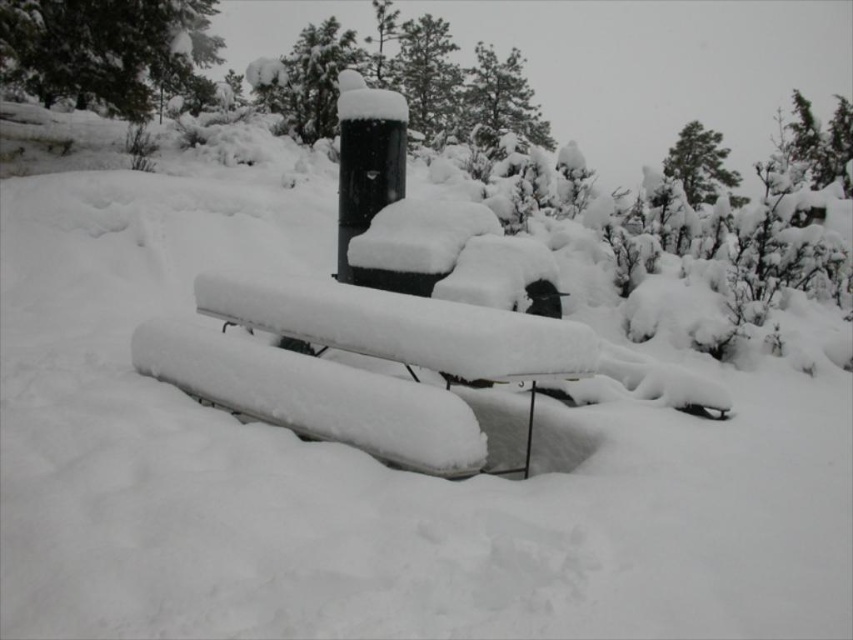
Which is below, green textured pine at upper left or green textured pine tree at upper center?

green textured pine at upper left is lower down.

What do you see at coordinates (103, 49) in the screenshot? Image resolution: width=853 pixels, height=640 pixels. I see `green textured pine at upper left` at bounding box center [103, 49].

The image size is (853, 640). Find the location of `green textured pine at upper left`. green textured pine at upper left is located at coordinates (103, 49).

Who is more forward, [534,349] or [727,180]?

Point [534,349]

Does point (366, 353) come in front of point (664, 168)?

Yes.

Locate an element on the screen. The image size is (853, 640). white snow-covered bench at center is located at coordinates (357, 369).

Is point (32, 51) less distant than point (730, 179)?

Yes, point (32, 51) is in front of point (730, 179).

Is green textured pine at upper left thinner than green textured tree at upper right?

Yes, green textured pine at upper left is thinner than green textured tree at upper right.

Is point (90, 48) closer to camera compared to point (718, 148)?

That is True.

The height and width of the screenshot is (640, 853). Identify the location of green textured pine at upper left. (103, 49).